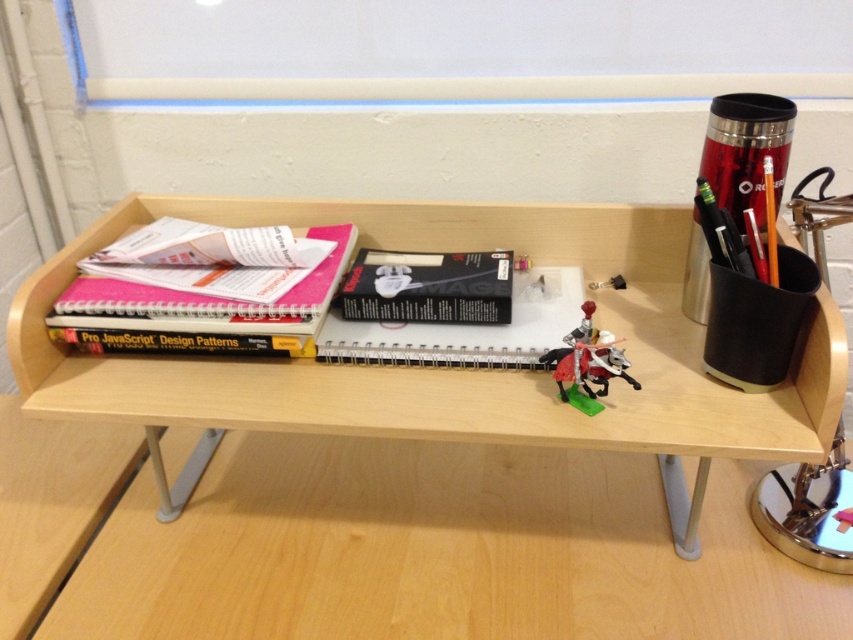
Does pink matte notebook at upper left have a smaller size compared to spiral-bound paper at center?

No, pink matte notebook at upper left is not smaller than spiral-bound paper at center.

Who is more distant from viewer, [296,353] or [396,326]?

Positioned behind is point [396,326].

The width and height of the screenshot is (853, 640). Find the location of `pink matte notebook at upper left`. pink matte notebook at upper left is located at coordinates (200, 310).

Which is in front, point (106, 280) or point (579, 381)?

Point (579, 381) is more forward.

Who is lower down, pink matte notebook at upper left or metallic silver toy at center?

metallic silver toy at center is lower down.

Find the location of a particular element. The height and width of the screenshot is (640, 853). pink matte notebook at upper left is located at coordinates (200, 310).

Looking at this image, does pink matte notebook at upper left have a smaller size compared to black matte notebook at center?

Actually, pink matte notebook at upper left might be larger than black matte notebook at center.

Who is more forward, (x=119, y=314) or (x=396, y=305)?

Point (x=119, y=314) is in front.

What do you see at coordinates (200, 310) in the screenshot?
I see `pink matte notebook at upper left` at bounding box center [200, 310].

Where is `pink matte notebook at upper left`? pink matte notebook at upper left is located at coordinates (200, 310).